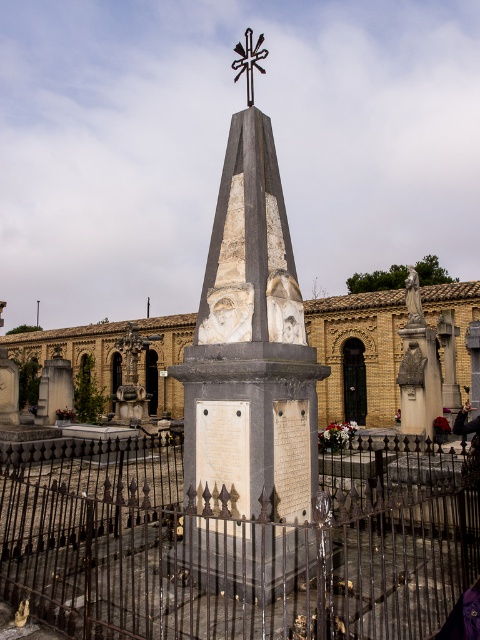
Question: Which point appears farthest from the camera in this image?

Choices:
 (A) (235, 214)
 (B) (132, 392)
 (C) (248, 51)
 (D) (292, 298)

Answer: (B)

Question: Which object is farther from the camera taking this photo?

Choices:
 (A) black wrought iron fence at center
 (B) matte stone statue at right

Answer: (B)

Question: Does black wrought iron fence at center have a larger size compared to white marble bust at center?

Choices:
 (A) no
 (B) yes

Answer: (B)

Question: From the image, what is the correct spatial relationship of black wrought iron fence at center in relation to matte stone statue at right?

Choices:
 (A) right
 (B) left

Answer: (B)

Question: Can you confirm if stone monument at center is bigger than white marble bust at center?

Choices:
 (A) yes
 (B) no

Answer: (A)

Question: Estimate the real-world distances between objects in this image. Which object is closer to the matte stone statue at right?

Choices:
 (A) black wrought iron fence at center
 (B) white marble bust at center
 (C) dark hair at center
 (D) metallic cross at center

Answer: (C)